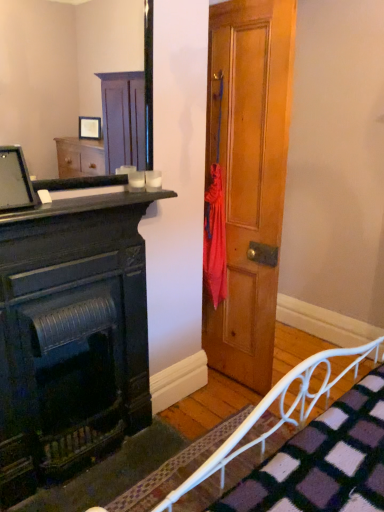
You are a GUI agent. You are given a task and a screenshot of the screen. Output one action in this format:
    pyautogui.click(x=<x>, y=<y>)
    Task: Click on the wooden frame mirror at upper left
    
    Given the screenshot: What is the action you would take?
    pyautogui.click(x=60, y=68)

What do you see at coordinates (280, 413) in the screenshot? The width and height of the screenshot is (384, 512). I see `white metal bed frame at lower right` at bounding box center [280, 413].

The height and width of the screenshot is (512, 384). What do you see at coordinates (249, 176) in the screenshot?
I see `wooden door at center` at bounding box center [249, 176].

Identify the location of matte black monitor at upper left. (15, 181).

Locate an element on the screen. The height and width of the screenshot is (512, 384). matte black fireplace at left is located at coordinates (71, 337).

How many degrees apart are the facing directions of matte black monitor at upper left and matte black fireplace at left?

They differ by 1.99 degrees in their facing directions.

Between matte black monitor at upper left and matte black fireplace at left, which one appears on the left side from the viewer's perspective?

From the viewer's perspective, matte black monitor at upper left appears more on the left side.

The width and height of the screenshot is (384, 512). I want to click on the chest of drawers that is below the matte black monitor at upper left (from the image's perspective), so click(x=71, y=337).

In terms of size, does matte black monitor at upper left appear bigger or smaller than matte black fireplace at left?

Clearly, matte black monitor at upper left is smaller in size than matte black fireplace at left.

Which point is more distant from viewer, (224,42) or (18,295)?

Point (224,42)

Does wooden door at center touch matte black fireplace at left?

No, wooden door at center is not in contact with matte black fireplace at left.

Is wooden door at center wider than matte black fireplace at left?

Yes, wooden door at center is wider than matte black fireplace at left.

Is wooden door at center aimed at matte black fireplace at left?

No, wooden door at center is not facing towards matte black fireplace at left.

Is matte black monitor at upper left at the left side of wooden frame mirror at upper left?

Indeed, matte black monitor at upper left is positioned on the left side of wooden frame mirror at upper left.

Considering the relative sizes of matte black monitor at upper left and wooden frame mirror at upper left in the image provided, is matte black monitor at upper left taller than wooden frame mirror at upper left?

No, matte black monitor at upper left is not taller than wooden frame mirror at upper left.

Is matte black monitor at upper left inside or outside of wooden frame mirror at upper left?

matte black monitor at upper left is not inside wooden frame mirror at upper left, it's outside.

Looking at this image, is matte black fireplace at left inside or outside of wooden frame mirror at upper left?

matte black fireplace at left is not enclosed by wooden frame mirror at upper left.

Is matte black fireplace at left turned away from wooden frame mirror at upper left?

No.

Does matte black fireplace at left have a larger size compared to wooden frame mirror at upper left?

Yes.

Is matte black fireplace at left with wooden frame mirror at upper left?

matte black fireplace at left and wooden frame mirror at upper left are clearly separated.

Between wooden door at center and matte black monitor at upper left, which one has more height?

wooden door at center.

Does wooden door at center have a lesser width compared to matte black monitor at upper left?

In fact, wooden door at center might be wider than matte black monitor at upper left.

How much distance is there between wooden door at center and matte black monitor at upper left?

The distance of wooden door at center from matte black monitor at upper left is 3.93 feet.

Is wooden door at center beside matte black monitor at upper left?

No, wooden door at center is not next to matte black monitor at upper left.

Between matte black fireplace at left and matte black monitor at upper left, which one appears on the left side from the viewer's perspective?

matte black monitor at upper left is more to the left.

Is matte black fireplace at left far away from matte black monitor at upper left?

Answer: No, matte black fireplace at left is not far away from matte black monitor at upper left.

Does matte black fireplace at left have a smaller size compared to matte black monitor at upper left?

No, matte black fireplace at left is not smaller than matte black monitor at upper left.

Which is in front, point (89, 347) or point (3, 152)?

The point (3, 152) is more forward.

Which of these two, white metal bed frame at lower right or matte black monitor at upper left, is wider?

white metal bed frame at lower right is wider.

Based on the photo, is the depth of white metal bed frame at lower right greater than that of matte black monitor at upper left?

No, the depth of white metal bed frame at lower right is less than that of matte black monitor at upper left.

Looking at this image, can we say white metal bed frame at lower right lies outside matte black monitor at upper left?

Yes, white metal bed frame at lower right is located beyond the bounds of matte black monitor at upper left.

Image resolution: width=384 pixels, height=512 pixels. Find the location of `the chest of drawers that appears below the matte black monitor at upper left (from a real-world perspective)`. the chest of drawers that appears below the matte black monitor at upper left (from a real-world perspective) is located at coordinates (71, 337).

Locate an element on the screen. door on the right side of matte black fireplace at left is located at coordinates (249, 176).

Based on their spatial positions, is matte black monitor at upper left or matte black fireplace at left further from white metal bed frame at lower right?

matte black monitor at upper left is positioned further to the anchor white metal bed frame at lower right.

When comparing their distances from matte black monitor at upper left, does matte black fireplace at left or wooden frame mirror at upper left seem closer?

matte black fireplace at left is closer to matte black monitor at upper left.

Based on their spatial positions, is wooden frame mirror at upper left or wooden door at center closer to white metal bed frame at lower right?

The object closer to white metal bed frame at lower right is wooden door at center.

Which object lies further to the anchor point wooden door at center, white metal bed frame at lower right or matte black monitor at upper left?

Among the two, matte black monitor at upper left is located further to wooden door at center.

Which object lies further to the anchor point wooden frame mirror at upper left, matte black monitor at upper left or matte black fireplace at left?

Among the two, matte black monitor at upper left is located further to wooden frame mirror at upper left.

Looking at the image, which one is located further to white metal bed frame at lower right, matte black fireplace at left or matte black monitor at upper left?

matte black monitor at upper left.

Based on their spatial positions, is matte black fireplace at left or wooden frame mirror at upper left closer to wooden door at center?

Among the two, matte black fireplace at left is located nearer to wooden door at center.

Based on their spatial positions, is matte black fireplace at left or wooden frame mirror at upper left further from white metal bed frame at lower right?

wooden frame mirror at upper left is further to white metal bed frame at lower right.

You are a GUI agent. You are given a task and a screenshot of the screen. Output one action in this format:
    pyautogui.click(x=<x>, y=<y>)
    Task: Click on the door between matte black monitor at upper left and white metal bed frame at lower right in the horizontal direction
    
    Given the screenshot: What is the action you would take?
    pyautogui.click(x=249, y=176)

You are a GUI agent. You are given a task and a screenshot of the screen. Output one action in this format:
    pyautogui.click(x=<x>, y=<y>)
    Task: Click on the door between wooden frame mirror at upper left and matte black fireplace at left from top to bottom
    The height and width of the screenshot is (512, 384).
    Given the screenshot: What is the action you would take?
    pyautogui.click(x=249, y=176)

Locate an element on the screen. chest of drawers between wooden frame mirror at upper left and white metal bed frame at lower right in the vertical direction is located at coordinates (71, 337).

Image resolution: width=384 pixels, height=512 pixels. Identify the location of computer monitor between wooden frame mirror at upper left and white metal bed frame at lower right in the vertical direction. (15, 181).